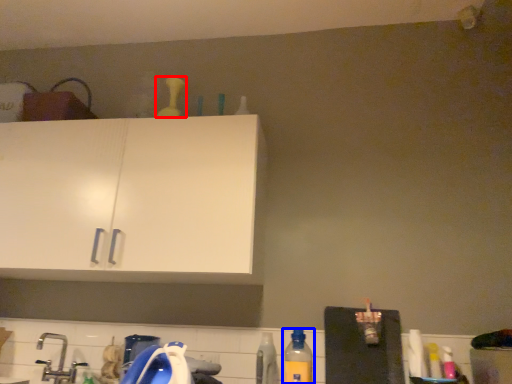
Question: Which point is further to the camera, bottle (highlighted by a red box) or bottle (highlighted by a blue box)?

Choices:
 (A) bottle
 (B) bottle

Answer: (A)